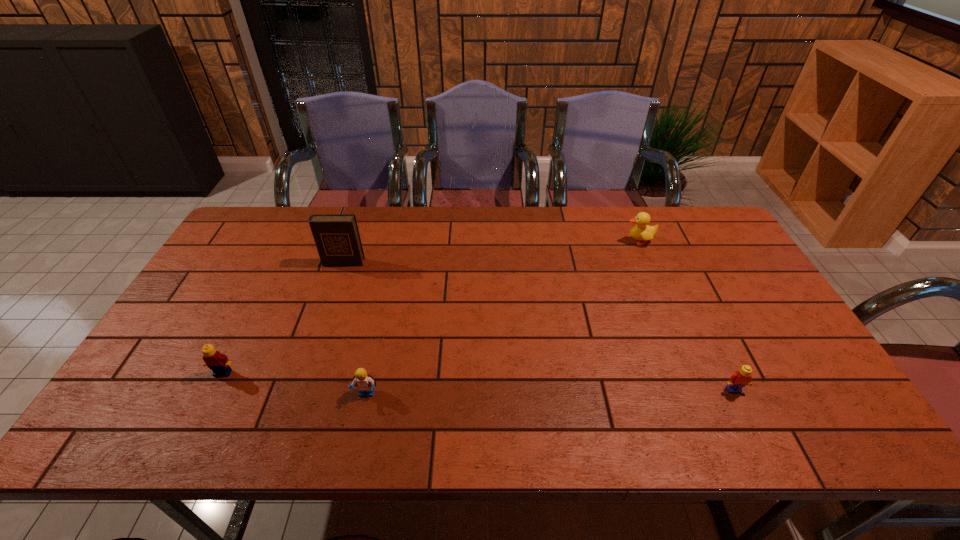
You are a GUI agent. You are given a task and a screenshot of the screen. Output one action in this format:
    pyautogui.click(x=<x>, y=<y>)
    Task: Click on the second closest object to the duckling
    Image resolution: width=960 pixels, height=540 pixels.
    Given the screenshot: What is the action you would take?
    pyautogui.click(x=337, y=238)

Where is `the third closest object to the rightmost Lego`? the third closest object to the rightmost Lego is located at coordinates (337, 238).

Choose which Lego is the nearest neighbor to the rightmost Lego. Please provide its 2D coordinates. Your answer should be formatted as a tuple, i.e. [(x, y)], where the tuple contains the x and y coordinates of a point satisfying the conditions above.

[(365, 382)]

Where is `Lego that stands as the closest to the second Lego from left to right`? Lego that stands as the closest to the second Lego from left to right is located at coordinates (218, 363).

Identify the location of vacant region that satisfies the following two spatial constraints: 1. on the front-facing side of the farthest object; 2. on the front-facing side of the leftmost object. The image size is (960, 540). click(694, 373).

Locate an element on the screen. Image resolution: width=960 pixels, height=540 pixels. vacant point that satisfies the following two spatial constraints: 1. on the front-facing side of the farthest object; 2. on the front-facing side of the leftmost Lego is located at coordinates (694, 373).

Where is `vacant position in the image that satisfies the following two spatial constraints: 1. on the front-facing side of the farthest object; 2. on the front cover of the second farthest object`? The image size is (960, 540). vacant position in the image that satisfies the following two spatial constraints: 1. on the front-facing side of the farthest object; 2. on the front cover of the second farthest object is located at coordinates (647, 262).

At what (x,y) coordinates should I click in order to perform the action: click on free space that satisfies the following two spatial constraints: 1. on the front-facing side of the farthest object; 2. on the front-facing side of the leftmost object. Please return your answer as a coordinate pair (x, y). Looking at the image, I should click on (694, 373).

The height and width of the screenshot is (540, 960). What are the coordinates of `vacant area in the image that satisfies the following two spatial constraints: 1. on the front-facing side of the farthest object; 2. on the front-facing side of the third object from left to right` in the screenshot? It's located at (703, 394).